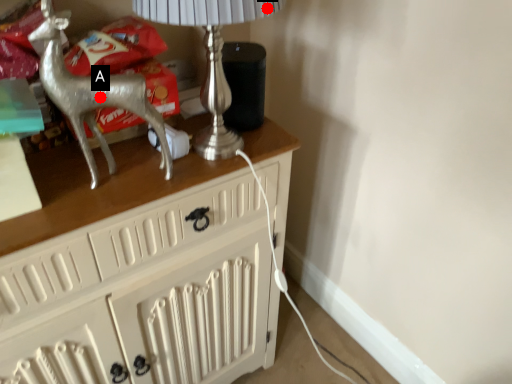
Question: Two points are circled on the image, labeled by A and B beside each circle. Among these points, which one is farthest from the camera?

Choices:
 (A) A is further
 (B) B is further

Answer: (A)